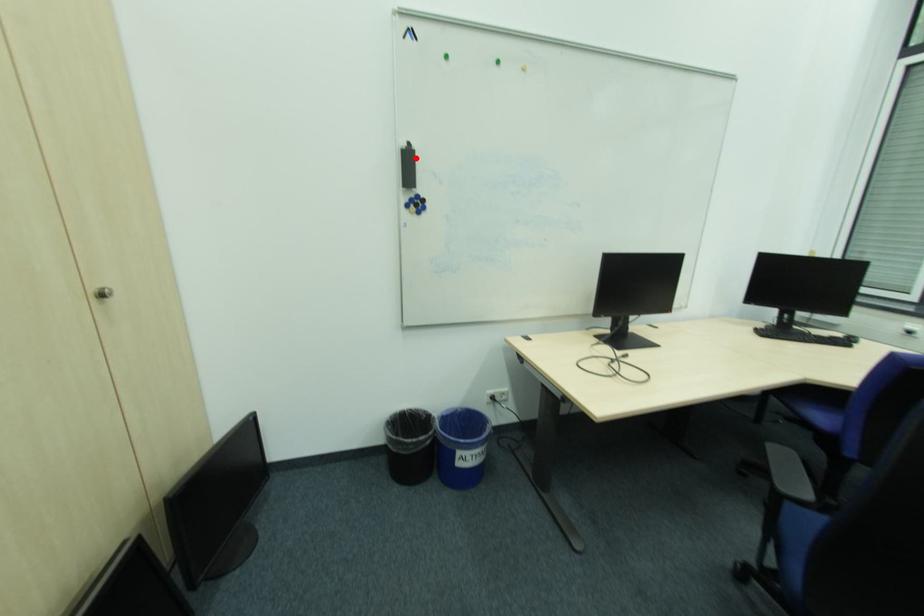
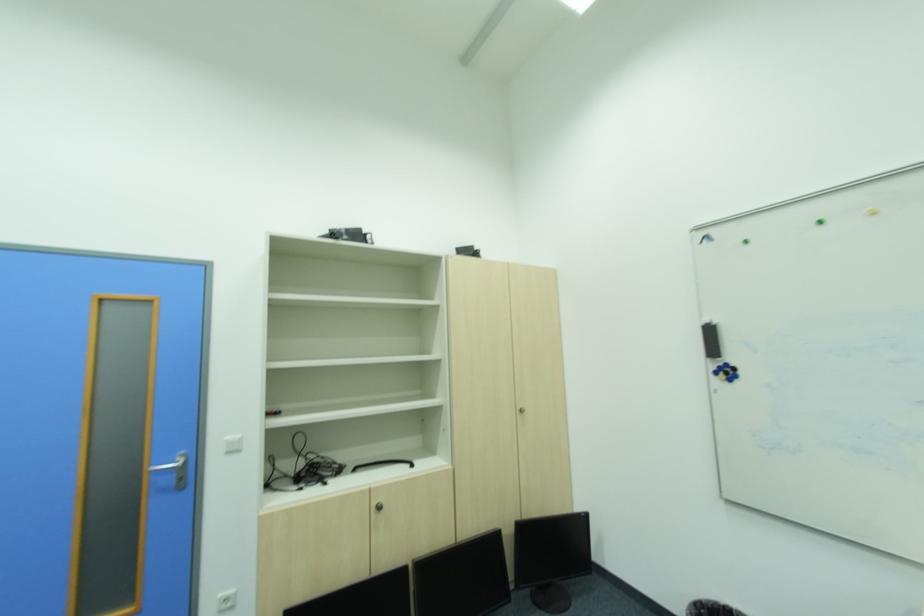
Find the pixel in the second image that matches the highlighted location in the first image.

(716, 331)